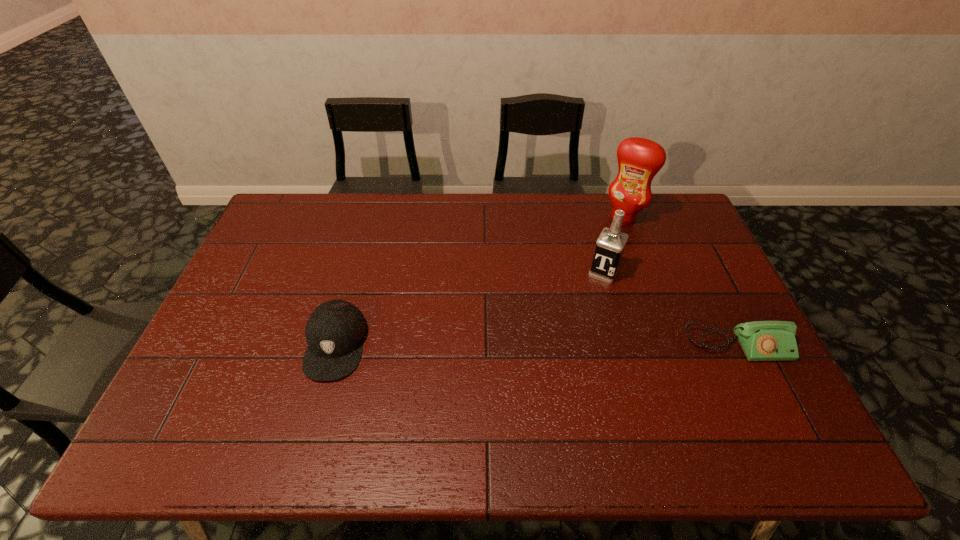
The height and width of the screenshot is (540, 960). I want to click on cap, so click(335, 331).

Locate an element on the screen. the third tallest object is located at coordinates (335, 331).

Locate an element on the screen. This screenshot has width=960, height=540. telephone is located at coordinates (761, 340).

Identify the location of the third nearest object. The image size is (960, 540). (610, 246).

The image size is (960, 540). Find the location of `vodka`. vodka is located at coordinates (610, 246).

Where is `the farthest object`? the farthest object is located at coordinates (639, 159).

Locate an element on the screen. The image size is (960, 540). the tallest object is located at coordinates (639, 159).

Where is `vacant space located on the front-facing side of the cap`? vacant space located on the front-facing side of the cap is located at coordinates (319, 406).

Where is `free location located 0.380m on the front label of the second tallest object`? free location located 0.380m on the front label of the second tallest object is located at coordinates (549, 379).

Locate an element on the screen. free location located 0.260m on the front label of the second tallest object is located at coordinates (566, 345).